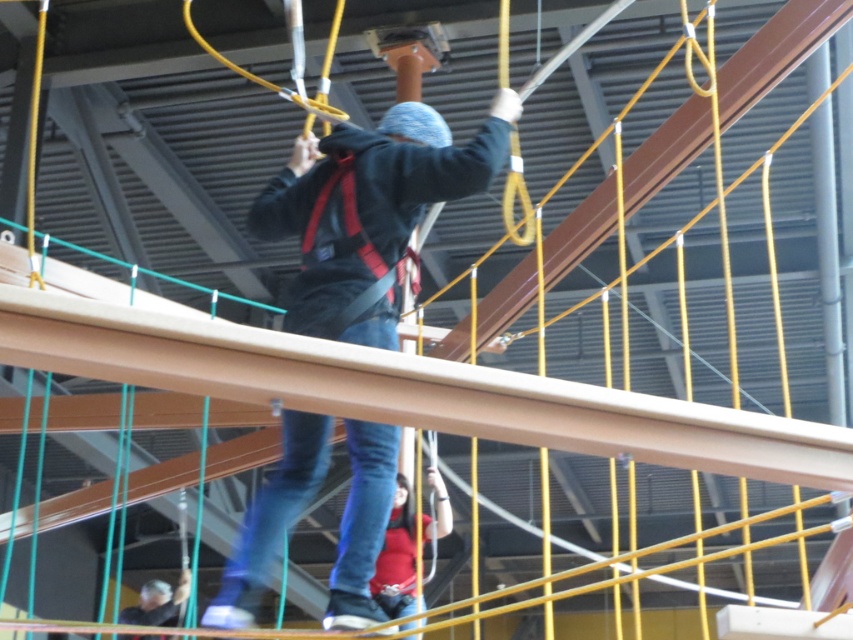
Question: Considering the real-world distances, which object is farthest from the matte red shirt at lower center?

Choices:
 (A) dark blue fleece jacket at center
 (B) brown metallic beam at center
 (C) dark gray fabric cap at lower left

Answer: (B)

Question: Does brown metallic beam at center have a smaller size compared to dark blue fleece jacket at center?

Choices:
 (A) no
 (B) yes

Answer: (B)

Question: Which is farther from the dark gray fabric cap at lower left?

Choices:
 (A) dark blue fleece jacket at center
 (B) brown metallic beam at center

Answer: (B)

Question: Is matte red shirt at lower center thinner than dark gray fabric cap at lower left?

Choices:
 (A) no
 (B) yes

Answer: (B)

Question: Is brown metallic beam at center to the right of dark gray fabric cap at lower left from the viewer's perspective?

Choices:
 (A) yes
 (B) no

Answer: (A)

Question: Which of the following is the farthest from the observer?

Choices:
 (A) dark blue fleece jacket at center
 (B) matte red shirt at lower center

Answer: (B)